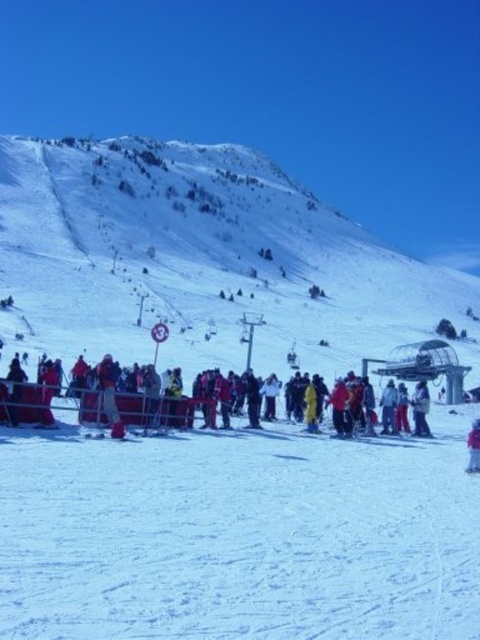
Based on the photo, you are standing at the red barrier and want to reach the sign with the number. Which point, point [27,385] or point [418,413], is closer to you?

Point [27,385] is closer to you because it is in front of point [418,413].

You are a photographer trying to capture a photo of both the red fabric crowd at center and the white matte jacket at center. Which one should you adjust your camera to focus on first if you want to ensure both are in the frame?

The red fabric crowd at center is positioned on the left side of white matte jacket at center. To ensure both are in the frame, focus on the white matte jacket at center first, then adjust the camera to include the red fabric crowd at center on the left.

You are a photographer at the ski resort and want to capture the white matte jacket at center and the pink fabric at center in the same frame. Which object should you focus on first if you want to ensure both are in focus without adjusting the camera settings?

The white matte jacket at center is thinner than the pink fabric at center, so you should focus on the pink fabric at center first since it has more depth and will require a narrower depth of field to keep both in focus.